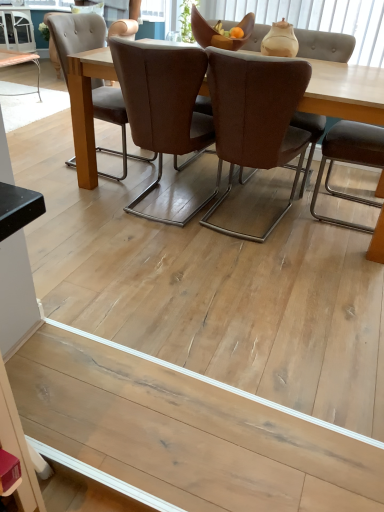
Locate an element on the screen. Image resolution: width=384 pixels, height=512 pixels. free point to the left of brown leather chair at right, marked as the third chair in a left-to-right arrangement is located at coordinates (287, 196).